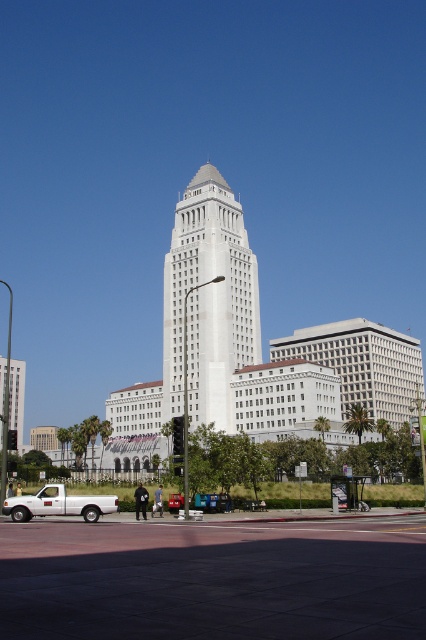
Question: Which point is closer to the camera?

Choices:
 (A) white matte truck at lower left
 (B) white smooth tower at center

Answer: (A)

Question: Is white smooth tower at center below white matte truck at lower left?

Choices:
 (A) no
 (B) yes

Answer: (A)

Question: Is white smooth tower at center positioned before white matte truck at lower left?

Choices:
 (A) no
 (B) yes

Answer: (A)

Question: Does white smooth tower at center appear on the left side of white matte truck at lower left?

Choices:
 (A) yes
 (B) no

Answer: (B)

Question: Which object appears closest to the camera in this image?

Choices:
 (A) white matte truck at lower left
 (B) white smooth tower at center

Answer: (A)

Question: Which point is farther to the camera?

Choices:
 (A) white smooth tower at center
 (B) white matte truck at lower left

Answer: (A)